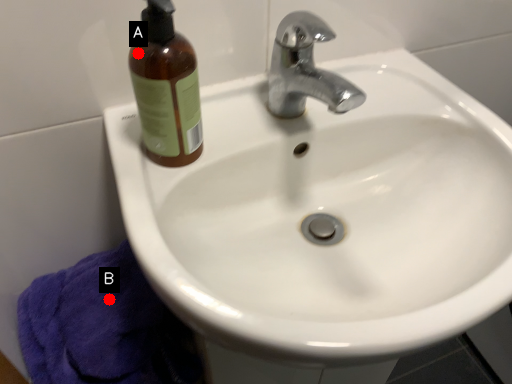
Question: Two points are circled on the image, labeled by A and B beside each circle. Among these points, which one is nearest to the camera?

Choices:
 (A) A is closer
 (B) B is closer

Answer: (A)